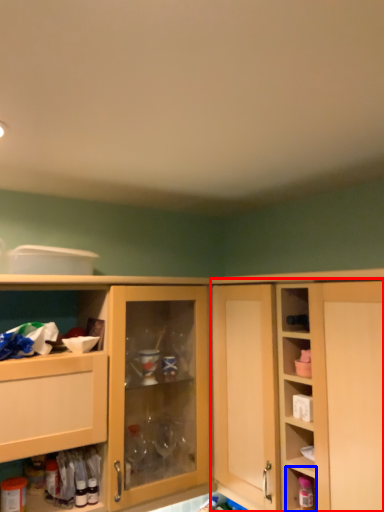
Question: Which object appears farthest to the camera in this image, cabinetry (highlighted by a red box) or cabinet (highlighted by a blue box)?

Choices:
 (A) cabinetry
 (B) cabinet

Answer: (B)